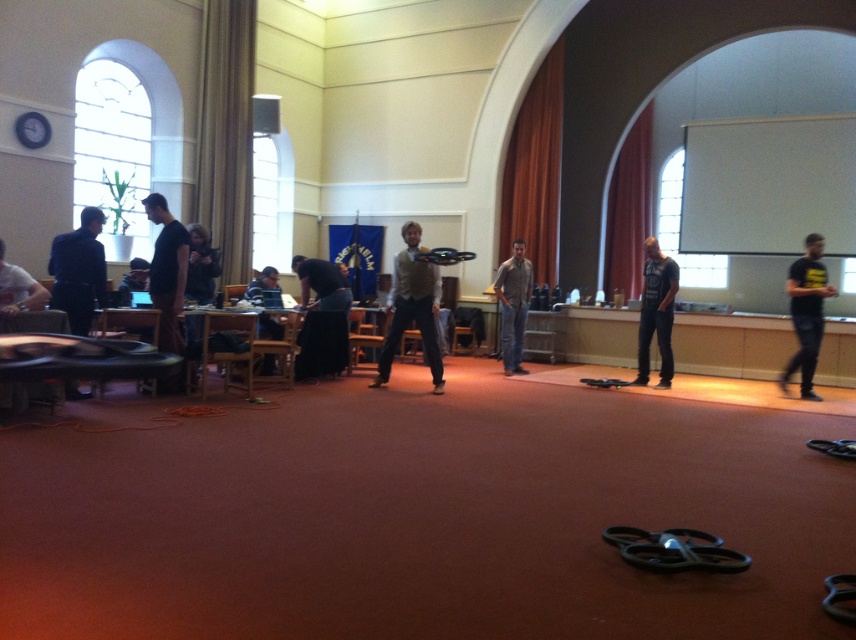
You are standing in the center of the room and want to greet the person wearing the white shirt at left. Which direction should you move to reach them?

The white shirt at left is located at point 0.452 on the x axis and 0.022 on the y axis. Since the person is at the left side of the image, you should move to your left to reach them.

You are organizing a group photo and need to arrange two people based on their clothing. The white shirt at left and dark blue shirt at center must be positioned side by side. Which person should stand on the left side of the pair to maintain the same visual proportion as in the image?

The white shirt at left should stand on the left side of the pair because it is thinner than the dark blue shirt at center, which would then be on the right to maintain the same visual proportion as in the image.

You are standing in the room and want to determine which of the two points, point (81, 220) or point (670, 321), is closer to you. Based on the image, which point is nearer?

Point (81, 220) is closer to the camera than point (670, 321), so it is the nearer point.